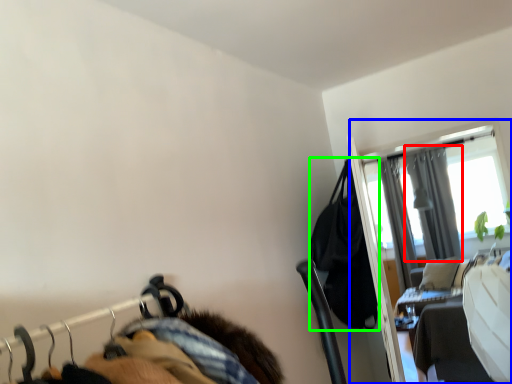
Question: Which object is the farthest from curtain (highlighted by a red box)? Choose among these: screen door (highlighted by a blue box) or clothing (highlighted by a green box).

Choices:
 (A) screen door
 (B) clothing

Answer: (B)